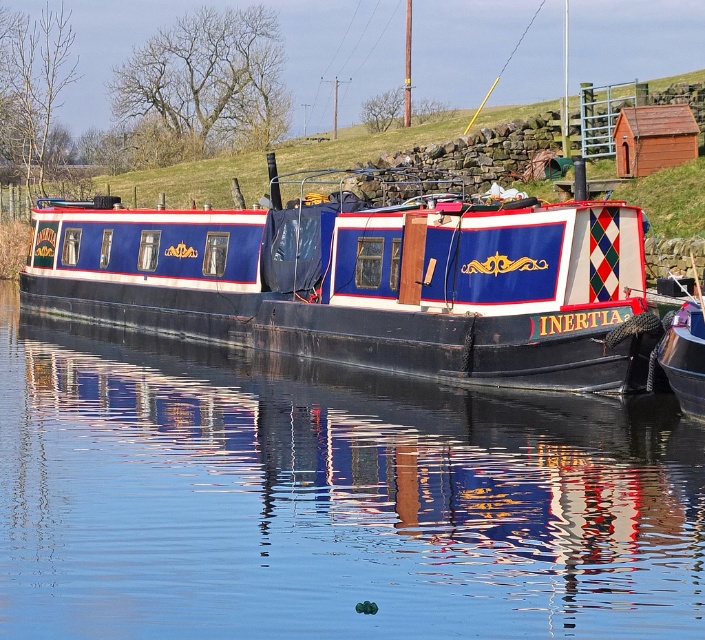
Question: Can you confirm if glossy black water at center is wider than blue painted wood barge at center?

Choices:
 (A) yes
 (B) no

Answer: (B)

Question: Which of the following is the farthest from the observer?

Choices:
 (A) tap(434, 260)
 (B) tap(678, 525)

Answer: (A)

Question: Which of the following is the farthest from the observer?

Choices:
 (A) (568, 340)
 (B) (336, 516)

Answer: (A)

Question: Can you confirm if glossy black water at center is bigger than blue painted wood barge at center?

Choices:
 (A) no
 (B) yes

Answer: (A)

Question: Is glossy black water at center in front of blue painted wood barge at center?

Choices:
 (A) no
 (B) yes

Answer: (B)

Question: Which of the following is the farthest from the observer?

Choices:
 (A) (152, 280)
 (B) (271, 480)

Answer: (A)